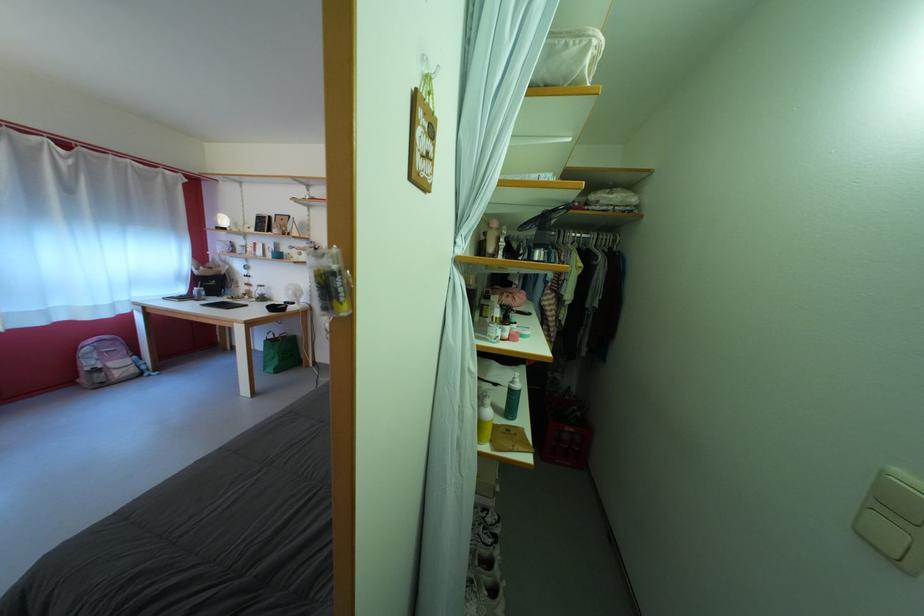
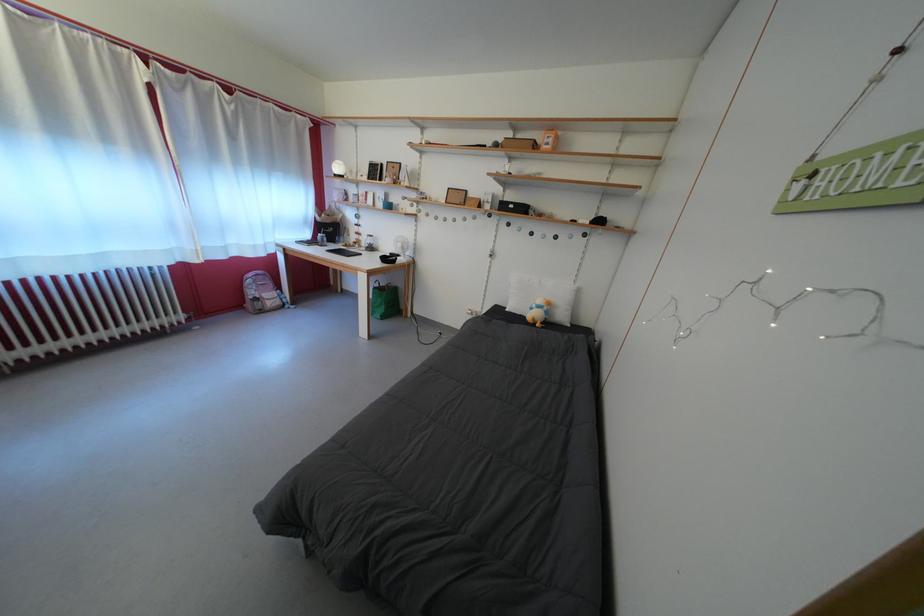
Question: Which direction would the cameraman need to move to produce the second image? Reply with the corresponding letter.

Choices:
 (A) Left
 (B) Right
 (C) Forward
 (D) Backward

Answer: (A)